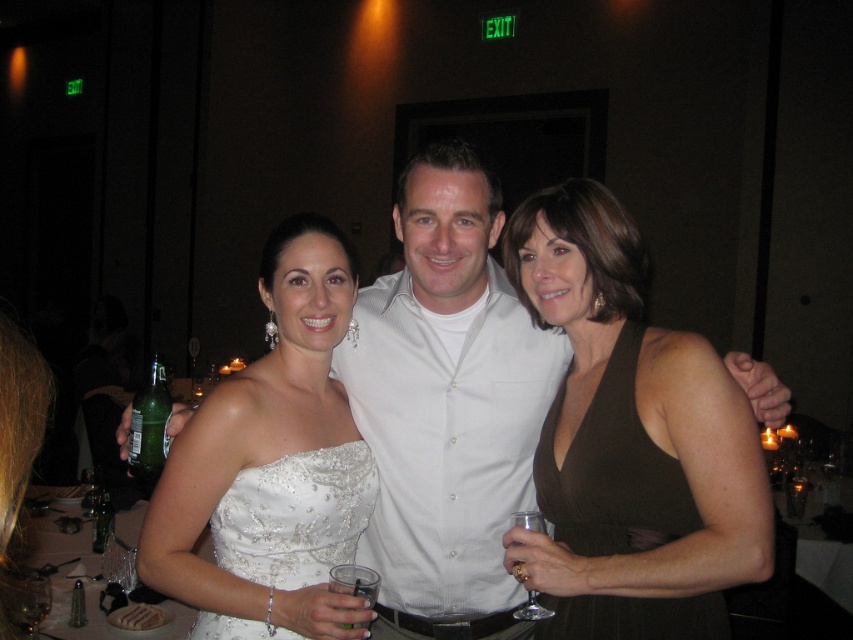
Question: Where is white satin dress at center located in relation to satin white dress at center in the image?

Choices:
 (A) right
 (B) left

Answer: (A)

Question: Among these points, which one is nearest to the camera?

Choices:
 (A) coord(345,624)
 (B) coord(524,513)
 (C) coord(604,449)

Answer: (A)

Question: Observing the image, what is the correct spatial positioning of white cotton shirt at center in reference to green glass bottle at lower left?

Choices:
 (A) right
 (B) left

Answer: (A)

Question: Among these points, which one is nearest to the camera?

Choices:
 (A) (520, 561)
 (B) (332, 586)

Answer: (B)

Question: Is green glass bottle at lower left below clear glass wine glass at lower left?

Choices:
 (A) no
 (B) yes

Answer: (A)

Question: Among these objects, which one is nearest to the camera?

Choices:
 (A) satin white dress at center
 (B) white satin dress at center
 (C) white cotton shirt at center

Answer: (A)